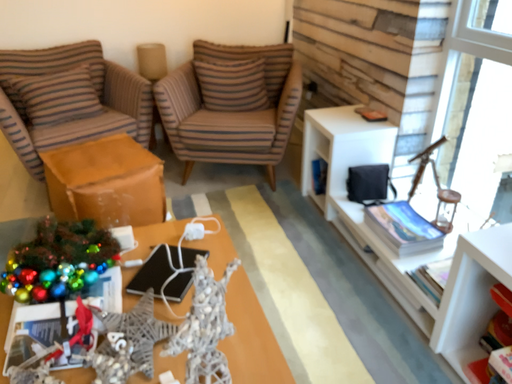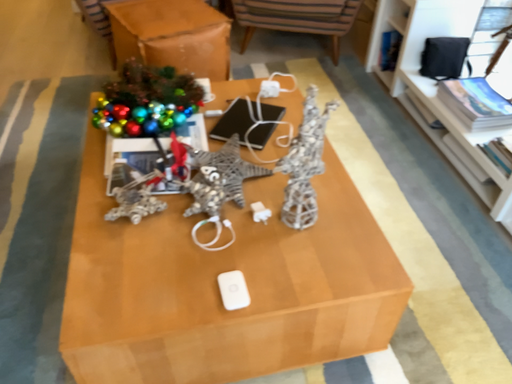
Question: How did the camera likely rotate when shooting the video?

Choices:
 (A) rotated downward
 (B) rotated upward

Answer: (A)